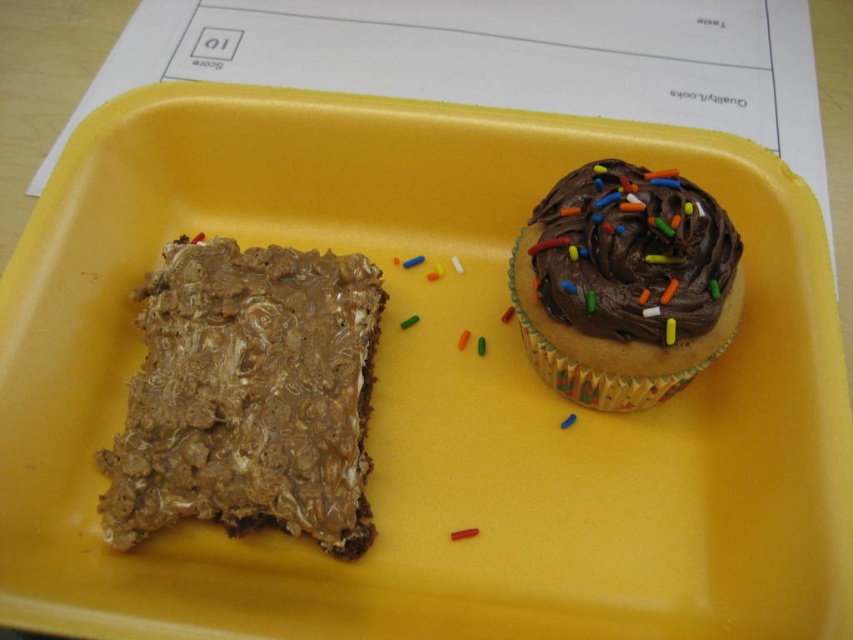
You are a food delivery person who needs to ensure the items in the yellow disposable tray are arranged properly. According to the delivery guidelines, the larger item must be placed at the center for stability. Is the current arrangement of the chocolatecrumblycake at left and the chocolate frosted cupcake at upper right following the guidelines?

The chocolatecrumblycake at left is bigger than the chocolate frosted cupcake at upper right. Since the larger item should be placed at the center, the current arrangement with the chocolatecrumblycake at left does not follow the guidelines. The chocolatecrumblycake at left should be moved to the center instead.

You are a food delivery robot that needs to pick up the chocolatecrumblycake at left and the chocolate frosted cupcake at upper right from the tray. The robot has two arms. Which arm should pick up which item to ensure the robot doesn,t spill anything?

The chocolatecrumblycake at left has a textured, crumbly surface, so it should be picked up by the left arm to avoid crumbs falling onto the chocolate frosted cupcake at upper right. The right arm can safely pick up the chocolate frosted cupcake at upper right since its smooth frosting is less likely to spill.